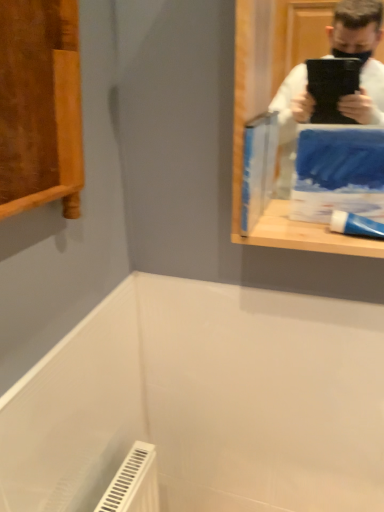
Question: Is white glossy toothpaste at right in front of or behind blue matte paperback book at upper right, the 1th paperback book from the right, in the image?

Choices:
 (A) front
 (B) behind

Answer: (B)

Question: Considering the positions of white glossy toothpaste at right and blue matte paperback book at upper right, the 1th paperback book from the right, in the image, is white glossy toothpaste at right taller or shorter than blue matte paperback book at upper right, the 1th paperback book from the right,?

Choices:
 (A) tall
 (B) short

Answer: (B)

Question: Which object is positioned closest to the blue paper at upper right, positioned as the second paperback book in right-to-left order?

Choices:
 (A) blue matte paperback book at upper right, the 1th paperback book from the right
 (B) white glossy toothpaste at right

Answer: (A)

Question: Which object is positioned closest to the blue paper at upper right, positioned as the second paperback book in right-to-left order?

Choices:
 (A) white glossy toothpaste at right
 (B) blue matte paperback book at upper right, the 1th paperback book from the right

Answer: (B)